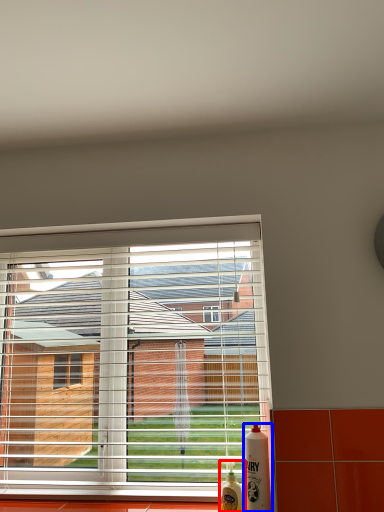
Question: Among these objects, which one is farthest to the camera, bottle (highlighted by a red box) or bottle (highlighted by a blue box)?

Choices:
 (A) bottle
 (B) bottle

Answer: (A)